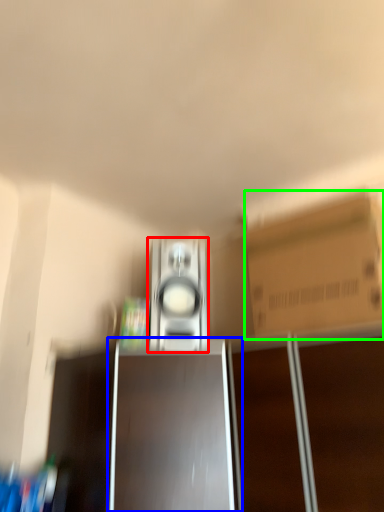
Question: Which object is the farthest from home appliance (highlighted by a red box)? Choose among these: cabinetry (highlighted by a blue box) or cardboard box (highlighted by a green box).

Choices:
 (A) cabinetry
 (B) cardboard box

Answer: (B)